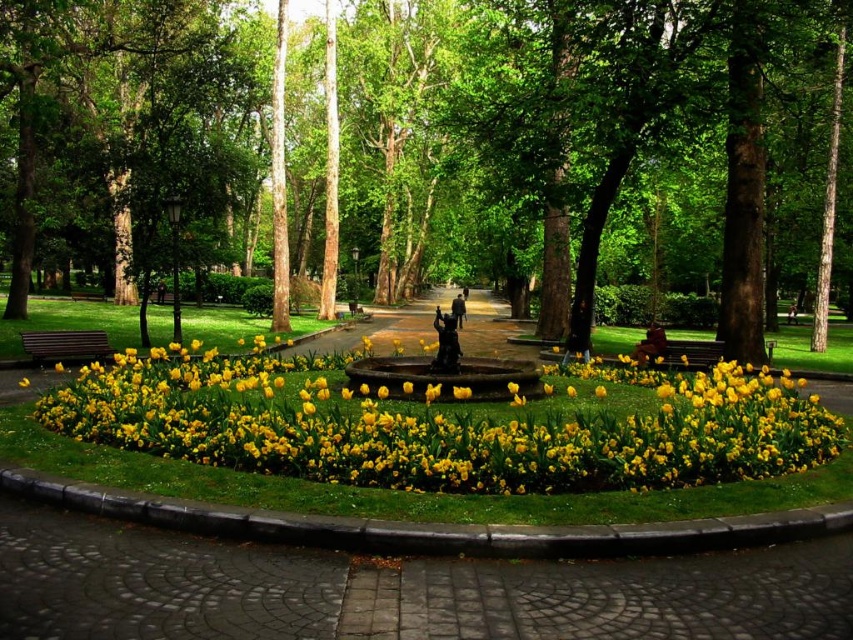
Question: Is yellow matte flowers at center closer to the viewer compared to wooden bench at left?

Choices:
 (A) no
 (B) yes

Answer: (B)

Question: Which object is closer to the camera taking this photo?

Choices:
 (A) yellow matte flowers at center
 (B) green leafy tree at center

Answer: (A)

Question: Which of the following is the closest to the observer?

Choices:
 (A) yellow matte flowers at center
 (B) green leafy tree at center
 (C) wooden bench at left

Answer: (A)

Question: Which object is farther from the camera taking this photo?

Choices:
 (A) green leafy tree at center
 (B) wooden bench at left

Answer: (B)

Question: Is green leafy tree at center further to camera compared to wooden bench at left?

Choices:
 (A) yes
 (B) no

Answer: (B)

Question: Can you confirm if green leafy tree at center is positioned to the right of wooden bench at left?

Choices:
 (A) no
 (B) yes

Answer: (B)